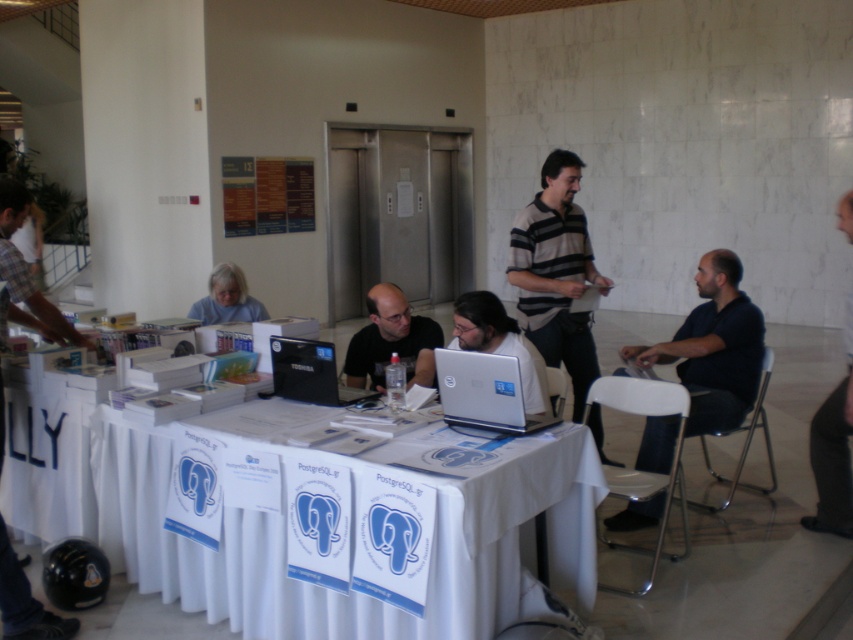
You are organizing a PostgreSQL workshop and need to place a projector screen that will be positioned at point 0.6, 0.35. Will the black glossy laptop at center interfere with the projector screen placement?

The black glossy laptop at center is located at point [309,372], which is very close to the projector screen position at [298,384]. Depending on the size of the laptop and screen, there might be interference. Please check the exact dimensions to ensure they don,t overlap.

You are organizing a tech conference and need to place a new banner between the black glossy laptop at center and the gray matte shirt at lower left. Based on their sizes, which object should the banner be placed closer to?

The banner should be placed closer to the gray matte shirt at lower left because the black glossy laptop at center is smaller in size compared to the gray matte shirt at lower left.